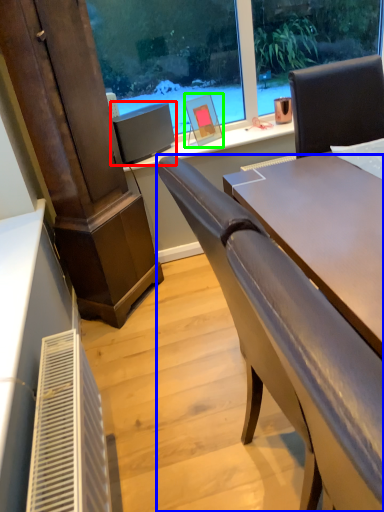
Question: Based on their relative distances, which object is nearer to computer monitor (highlighted by a red box)? Choose from chair (highlighted by a blue box) and picture frame (highlighted by a green box).

Choices:
 (A) chair
 (B) picture frame

Answer: (B)